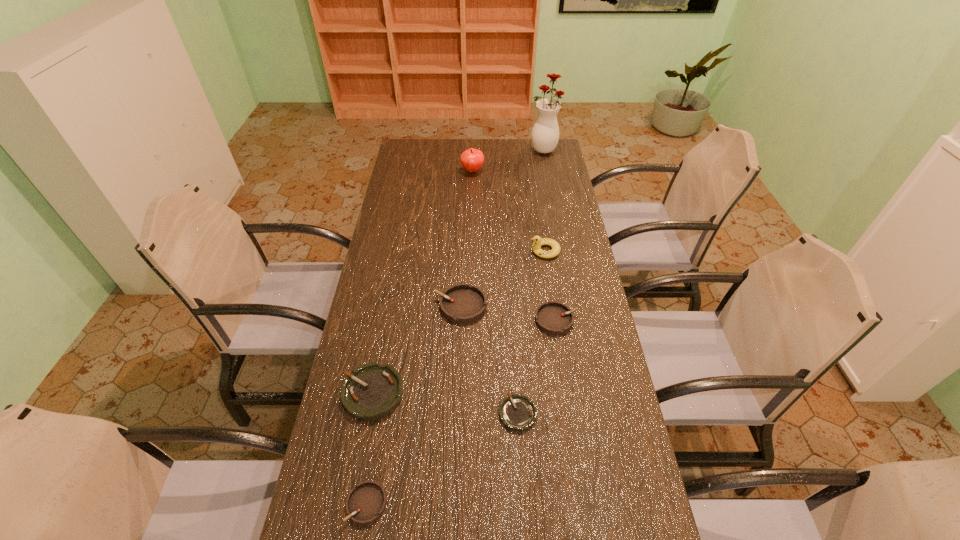
You are a GUI agent. You are given a task and a screenshot of the screen. Output one action in this format:
    pyautogui.click(x=<x>, y=<y>)
    Task: Click on the object present at the far right corner
    The image size is (960, 540).
    Given the screenshot: What is the action you would take?
    pyautogui.click(x=545, y=134)

This screenshot has width=960, height=540. In the image, there is a desktop. Find the location of `vacant space at the far edge`. vacant space at the far edge is located at coordinates (504, 157).

Image resolution: width=960 pixels, height=540 pixels. In the image, there is a desktop. Identify the location of free space at the left edge. (395, 342).

Where is `vacant space at the right edge of the desktop`? vacant space at the right edge of the desktop is located at coordinates (556, 196).

Identify the location of vacant region between the second shortest ashtray and the third tallest object. (456, 377).

At what (x,y) coordinates should I click in order to perform the action: click on unoccupied position between the tallest object and the left green ashtray. Please return your answer as a coordinate pair (x, y). This screenshot has width=960, height=540. Looking at the image, I should click on (458, 271).

The width and height of the screenshot is (960, 540). I want to click on vacant space that's between the right green ashtray and the left green ashtray, so click(x=445, y=403).

Identify the location of unoccupied area between the third ashtray from left to right and the red apple. Image resolution: width=960 pixels, height=540 pixels. (467, 238).

Find the location of a particular element. free area in between the second shortest ashtray and the vase is located at coordinates (455, 327).

I want to click on free space that is in between the fourth object from right to left and the sixth shortest object, so click(531, 332).